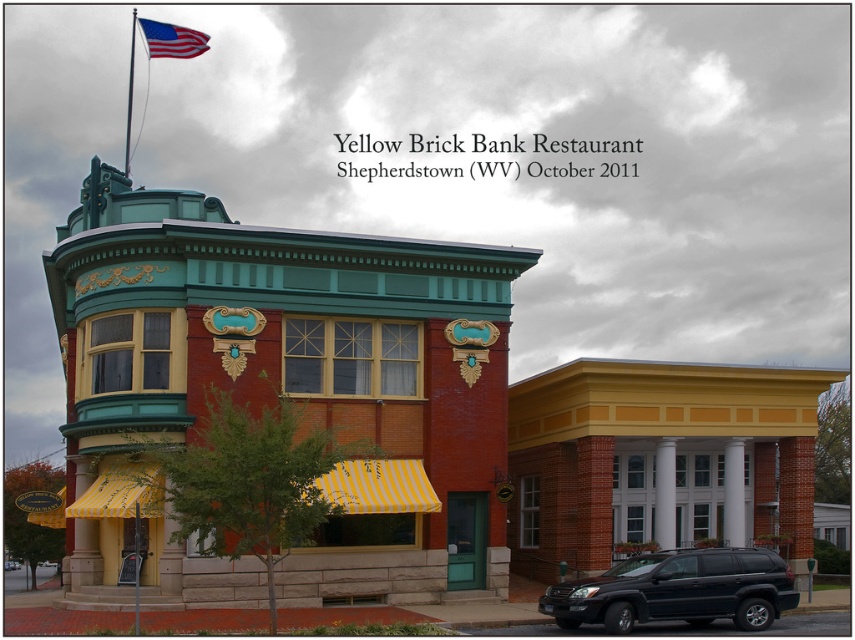
Can you confirm if brick building at center is positioned below black matte suv at lower right?

No.

Between brick building at center and black matte suv at lower right, which one has more height?

With more height is brick building at center.

Between point (204, 349) and point (793, 589), which one is positioned in front?

Point (793, 589) is more forward.

This screenshot has width=855, height=640. Identify the location of brick building at center. (284, 388).

Is brick building at center closer to the viewer compared to metallic flag pole at upper left?

Yes, brick building at center is in front of metallic flag pole at upper left.

How much distance is there between brick building at center and metallic flag pole at upper left?

They are 14.71 meters apart.

Is point (175, 385) positioned before point (133, 54)?

That is True.

Locate an element on the screen. Image resolution: width=855 pixels, height=640 pixels. brick building at center is located at coordinates (284, 388).

Between american flag at top left and metallic flag pole at upper left, which one is positioned lower?

metallic flag pole at upper left is below.

Who is more forward, (144, 33) or (127, 161)?

Positioned in front is point (144, 33).

You are a GUI agent. You are given a task and a screenshot of the screen. Output one action in this format:
    pyautogui.click(x=<x>, y=<y>)
    Task: Click on the american flag at top left
    The width and height of the screenshot is (855, 640).
    Given the screenshot: What is the action you would take?
    pyautogui.click(x=171, y=38)